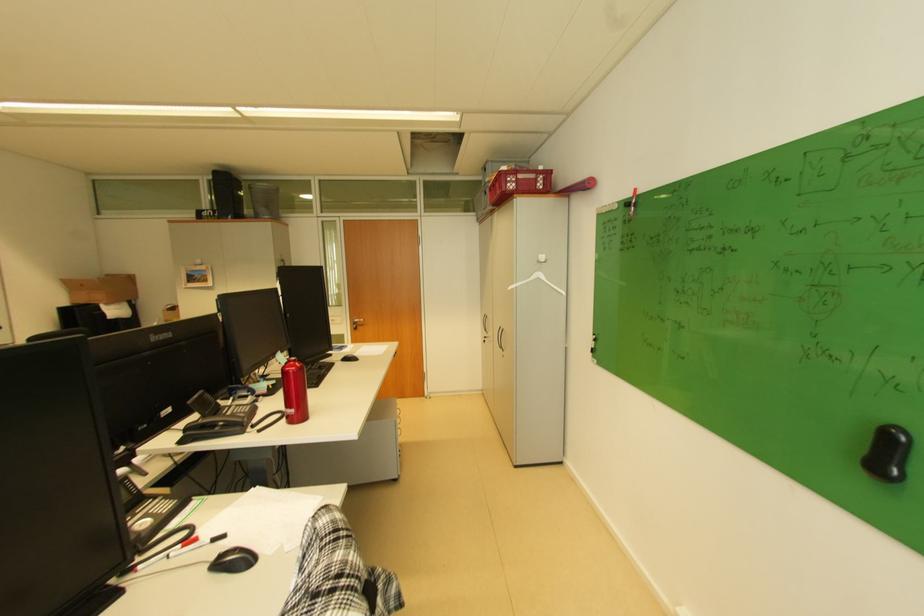
Find the location of `red water bottle`. red water bottle is located at coordinates (295, 391).